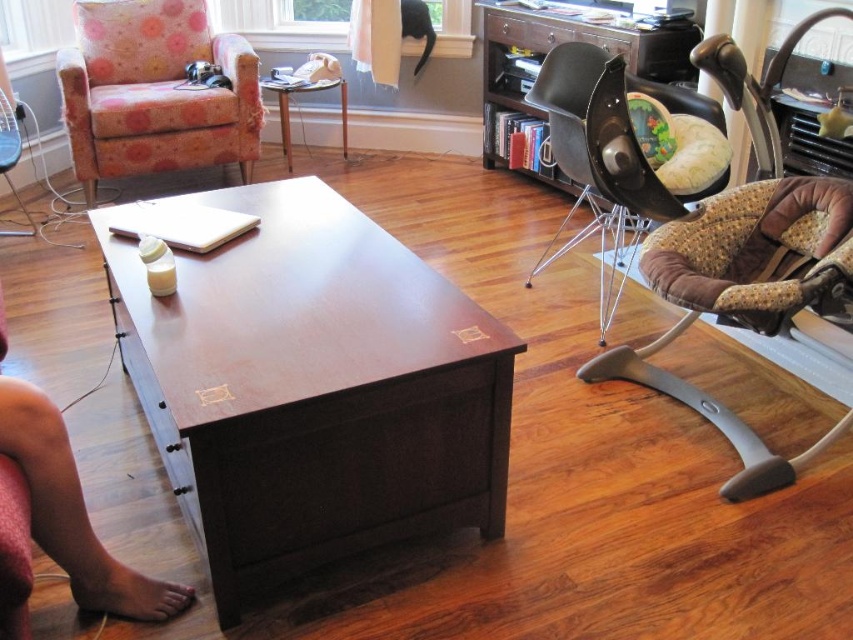
Does floral fabric swivel chair at left appear under wooden table at center?

Incorrect, floral fabric swivel chair at left is not positioned below wooden table at center.

Looking at this image, is floral fabric swivel chair at left positioned behind wooden table at center?

That is False.

Between point (166, 157) and point (343, 112), which one is positioned behind?

Positioned behind is point (343, 112).

Where is `floral fabric swivel chair at left`? floral fabric swivel chair at left is located at coordinates (154, 92).

Can you confirm if dark brown wood table at center is positioned to the left of wooden table at center?

In fact, dark brown wood table at center is to the right of wooden table at center.

Who is more distant from viewer, (320, 397) or (276, 90)?

The point (276, 90) is behind.

Between point (492, 497) and point (345, 132), which one is positioned in front?

Point (492, 497) is more forward.

Locate an element on the screen. dark brown wood table at center is located at coordinates (312, 388).

Is dark brown wood table at center to the right of floral fabric swivel chair at left from the viewer's perspective?

Yes, dark brown wood table at center is to the right of floral fabric swivel chair at left.

Measure the distance between point (263, 380) and camera.

Point (263, 380) and camera are 4.44 feet apart from each other.

This screenshot has width=853, height=640. In order to click on dark brown wood table at center in this screenshot , I will do (x=312, y=388).